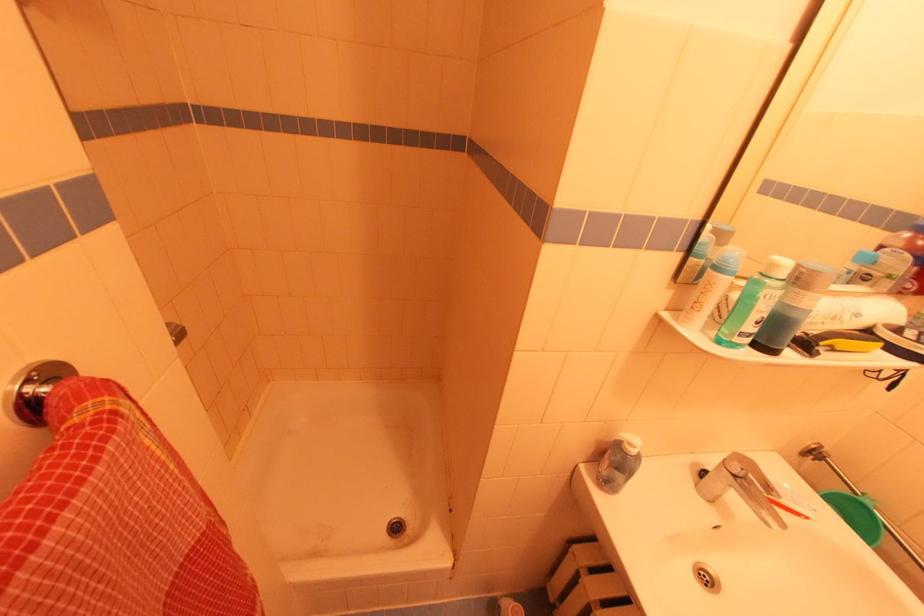
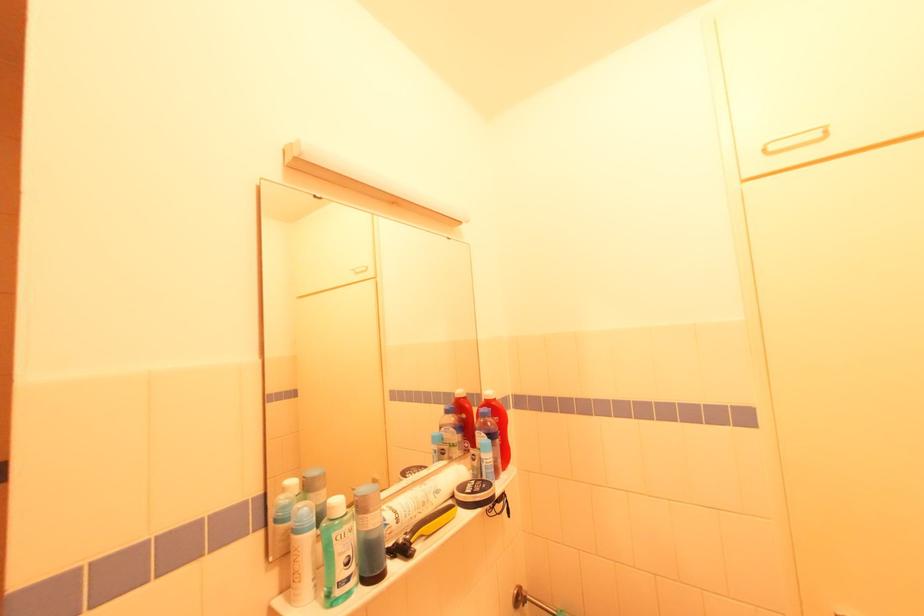
Locate, in the second image, the point that corresponds to (x=807, y=347) in the first image.

(406, 552)